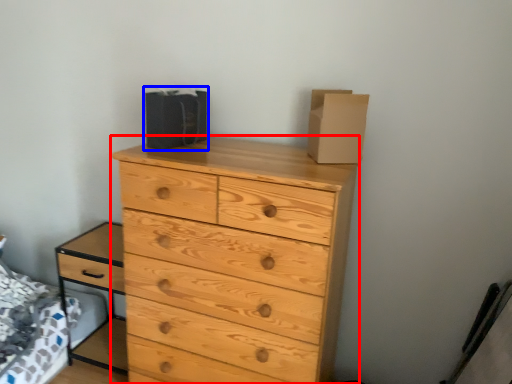
Question: Which object is further to the camera taking this photo, chest of drawers (highlighted by a red box) or cardboard box (highlighted by a blue box)?

Choices:
 (A) chest of drawers
 (B) cardboard box

Answer: (B)